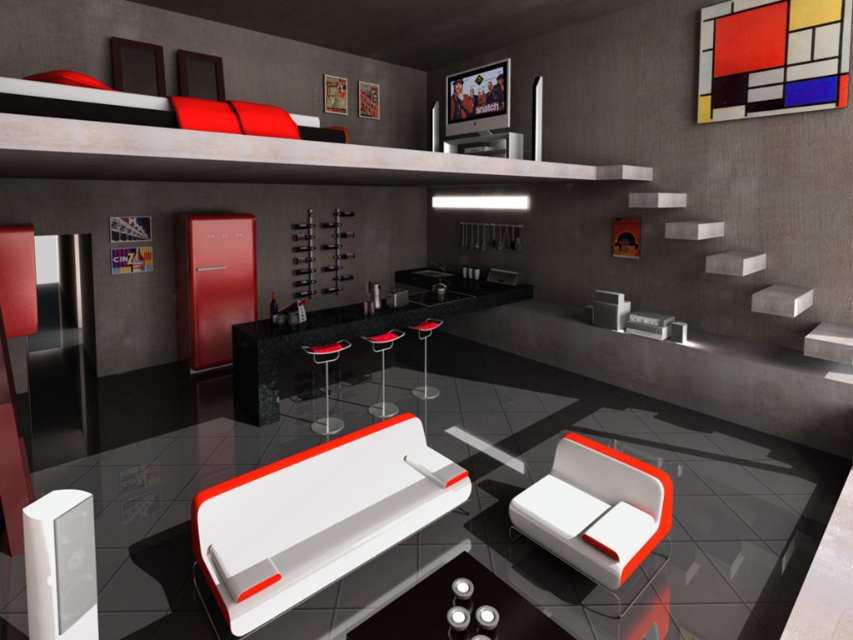
You are planning to place a large rectangular rug in the living room. The rug needs to cover both the white matte couch at center and the metallic silver coffee table at center. Based on their sizes, will the rug need to be wider than the couch to accommodate both objects?

The white matte couch at center might be wider than metallic silver coffee table at center, so the rug should be wider than the couch to ensure both objects are fully covered.